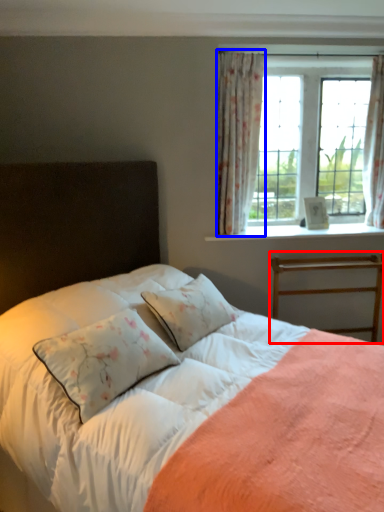
Question: Which of the following is the closest to the observer, bed frame (highlighted by a red box) or curtain (highlighted by a blue box)?

Choices:
 (A) bed frame
 (B) curtain

Answer: (B)